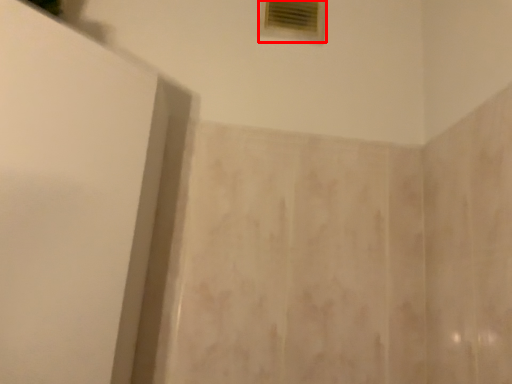
Question: From the image's perspective, considering the relative positions of window (annotated by the red box) and screen door in the image provided, where is window (annotated by the red box) located with respect to the staircase?

Choices:
 (A) below
 (B) above

Answer: (B)